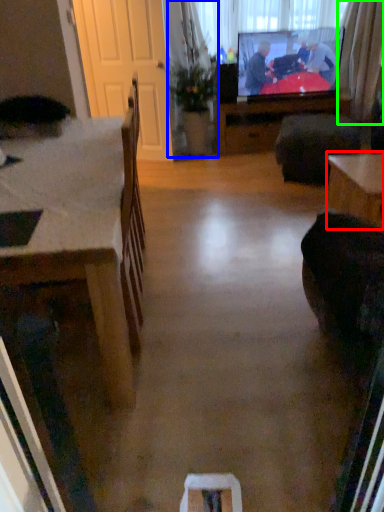
Question: Which object is the closest to the table (highlighted by a red box)? Choose among these: houseplant (highlighted by a blue box) or curtain (highlighted by a green box).

Choices:
 (A) houseplant
 (B) curtain

Answer: (A)